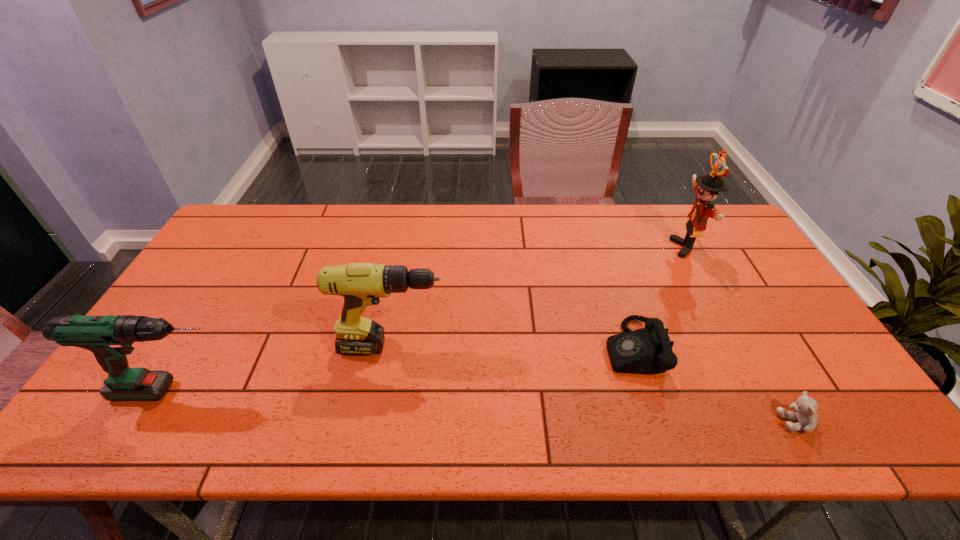
The height and width of the screenshot is (540, 960). What are the coordinates of `nutcracker` in the screenshot? It's located at (706, 187).

Identify the location of the tallest object. (706, 187).

This screenshot has width=960, height=540. I want to click on the farther drill, so pos(361,284).

Locate an element on the screen. the second object from left to right is located at coordinates (361, 284).

Where is `the nearer drill`? the nearer drill is located at coordinates (110, 337).

At what (x,y) coordinates should I click in order to perform the action: click on the leftmost object. Please return your answer as a coordinate pair (x, y). The image size is (960, 540). Looking at the image, I should click on (110, 337).

Where is `the third object from left to right`? The height and width of the screenshot is (540, 960). the third object from left to right is located at coordinates [648, 350].

At what (x,y) coordinates should I click in order to perform the action: click on teddy bear. Please return your answer as a coordinate pair (x, y). Looking at the image, I should click on (805, 407).

I want to click on vacant space located 0.360m on the front-facing side of the farthest object, so click(x=564, y=248).

At what (x,y) coordinates should I click in order to perform the action: click on free space located 0.130m on the front-facing side of the farthest object. Please return your answer as a coordinate pair (x, y). Image resolution: width=960 pixels, height=540 pixels. Looking at the image, I should click on (634, 248).